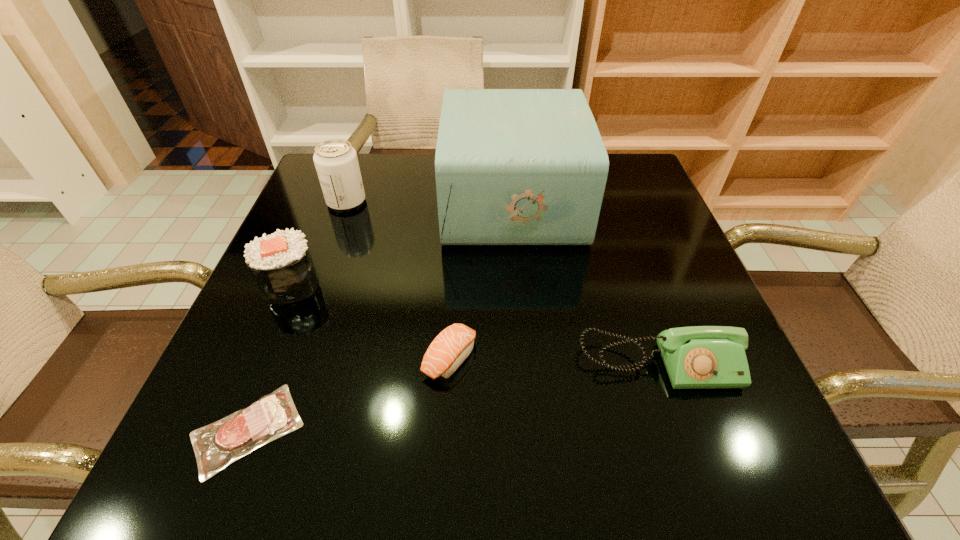
The height and width of the screenshot is (540, 960). Identify the location of steak at the left edge. (217, 445).

At what (x,y) coordinates should I click in order to perform the action: click on object present at the right edge. Please return your answer as a coordinate pair (x, y). The height and width of the screenshot is (540, 960). Looking at the image, I should click on (699, 357).

Identify the location of object situated at the far left corner. This screenshot has height=540, width=960. (336, 162).

Where is `object situated at the near left corner`? This screenshot has width=960, height=540. object situated at the near left corner is located at coordinates (217, 445).

The width and height of the screenshot is (960, 540). In order to click on free space at the far edge of the desktop in this screenshot , I will do `click(390, 187)`.

The image size is (960, 540). Find the location of `free space at the near edge`. free space at the near edge is located at coordinates (603, 453).

The height and width of the screenshot is (540, 960). I want to click on blank space at the left edge, so click(x=310, y=208).

I want to click on blank space at the right edge of the desktop, so click(708, 299).

Where is `vacant space at the far right corner of the desktop`? vacant space at the far right corner of the desktop is located at coordinates point(628,172).

Locate an element on the screen. free space between the third shortest object and the radio receiver is located at coordinates (586, 282).